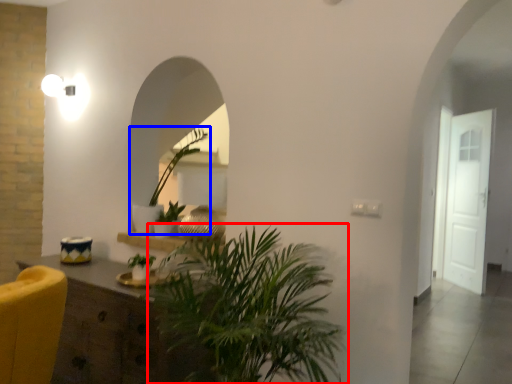
Question: Which point is further to the camera, houseplant (highlighted by a red box) or houseplant (highlighted by a blue box)?

Choices:
 (A) houseplant
 (B) houseplant

Answer: (B)